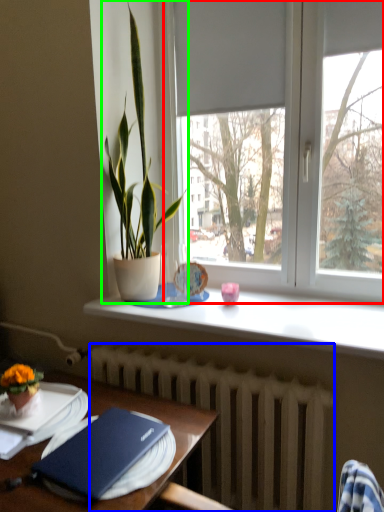
Question: Which is nearer to the window (highlighted by a red box)? radiator (highlighted by a blue box) or houseplant (highlighted by a green box).

Choices:
 (A) radiator
 (B) houseplant

Answer: (B)